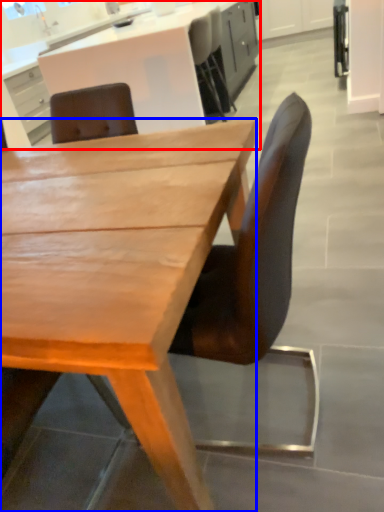
Question: Which point is further to the camera, cabinetry (highlighted by a red box) or desk (highlighted by a blue box)?

Choices:
 (A) cabinetry
 (B) desk

Answer: (A)